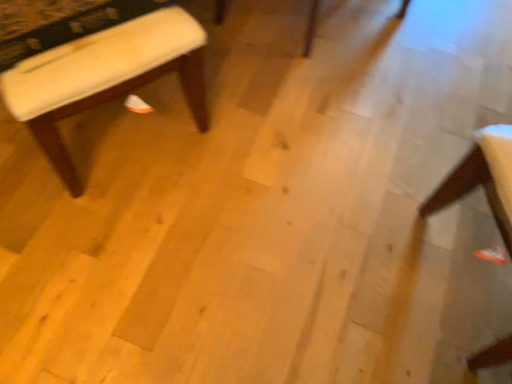
Question: Is white fabric chair at lower right closer to the viewer compared to white fabric stool at left?

Choices:
 (A) no
 (B) yes

Answer: (B)

Question: Would you consider white fabric chair at lower right to be distant from white fabric stool at left?

Choices:
 (A) yes
 (B) no

Answer: (A)

Question: Is white fabric chair at lower right in contact with white fabric stool at left?

Choices:
 (A) no
 (B) yes

Answer: (A)

Question: Is white fabric chair at lower right facing away from white fabric stool at left?

Choices:
 (A) no
 (B) yes

Answer: (A)

Question: Is white fabric chair at lower right behind white fabric stool at left?

Choices:
 (A) yes
 (B) no

Answer: (B)

Question: From a real-world perspective, is white fabric chair at lower right located higher than white fabric stool at left?

Choices:
 (A) yes
 (B) no

Answer: (B)

Question: Is white fabric stool at left bigger than white fabric chair at lower right?

Choices:
 (A) yes
 (B) no

Answer: (A)

Question: Is white fabric stool at left to the left of white fabric chair at lower right from the viewer's perspective?

Choices:
 (A) yes
 (B) no

Answer: (A)

Question: Is white fabric stool at left outside white fabric chair at lower right?

Choices:
 (A) no
 (B) yes

Answer: (B)

Question: Considering the relative sizes of white fabric stool at left and white fabric chair at lower right in the image provided, is white fabric stool at left wider than white fabric chair at lower right?

Choices:
 (A) yes
 (B) no

Answer: (A)

Question: Does white fabric stool at left appear on the right side of white fabric chair at lower right?

Choices:
 (A) no
 (B) yes

Answer: (A)

Question: Is white fabric stool at left oriented towards white fabric chair at lower right?

Choices:
 (A) no
 (B) yes

Answer: (A)

Question: Is white fabric chair at lower right inside or outside of white fabric stool at left?

Choices:
 (A) outside
 (B) inside

Answer: (A)